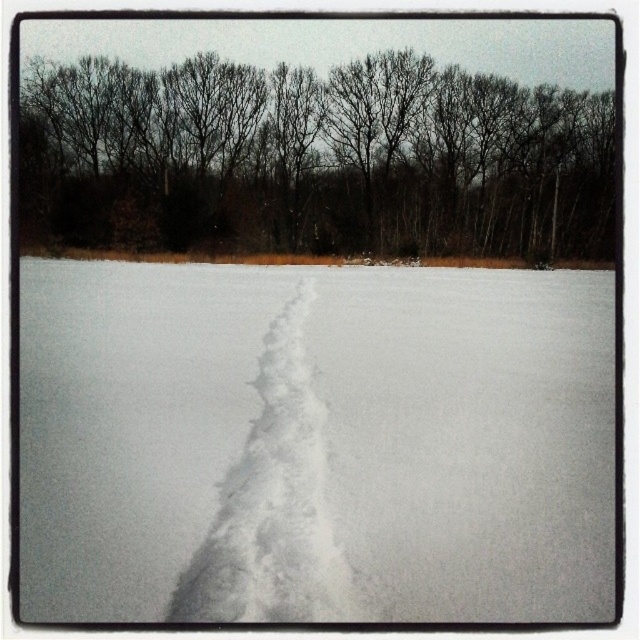
Question: Among these objects, which one is nearest to the camera?

Choices:
 (A) bare branches at upper center
 (B) white fluffy snow trail at center

Answer: (B)

Question: Which object is closer to the camera taking this photo?

Choices:
 (A) bare branches at upper center
 (B) white fluffy snow trail at center

Answer: (B)

Question: Can you confirm if bare branches at upper center is positioned to the right of white fluffy snow trail at center?

Choices:
 (A) no
 (B) yes

Answer: (A)

Question: Is bare branches at upper center below white fluffy snow trail at center?

Choices:
 (A) yes
 (B) no

Answer: (B)

Question: Does bare branches at upper center come in front of white fluffy snow trail at center?

Choices:
 (A) no
 (B) yes

Answer: (A)